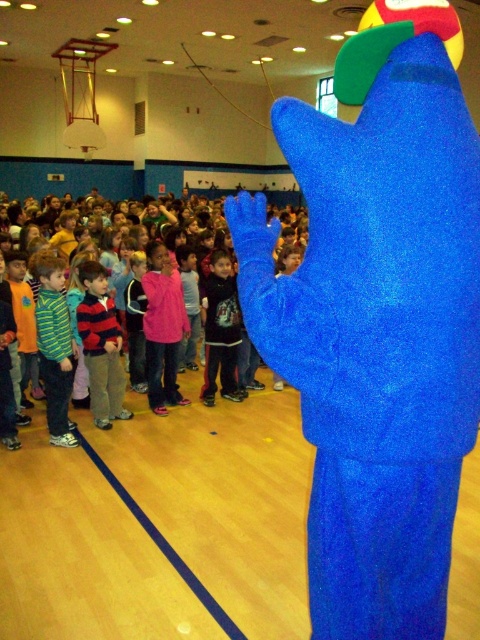
You are a photographer trying to capture a photo of the striped sweater at center and dark blue fleece jacket at center. Which one should you focus on first if you want to include both in the frame without moving the camera?

The striped sweater at center is shorter than the dark blue fleece jacket at center, so you should focus on the dark blue fleece jacket at center first to ensure it is fully in the frame since it is taller.

You are a photographer trying to capture a photo of the striped sweater at center and the dark blue fleece jacket at center. Which one will appear larger in the photo?

The striped sweater at center will appear larger in the photo because it is closer to the viewer than the dark blue fleece jacket at center.

In the scene shown: You are a photographer trying to capture a group photo of the children in the gymnasium. You notice the striped sweater at center and the dark blue fleece jacket at center. Which clothing item is narrower in width?

The striped sweater at center is narrower in width than the dark blue fleece jacket at center.